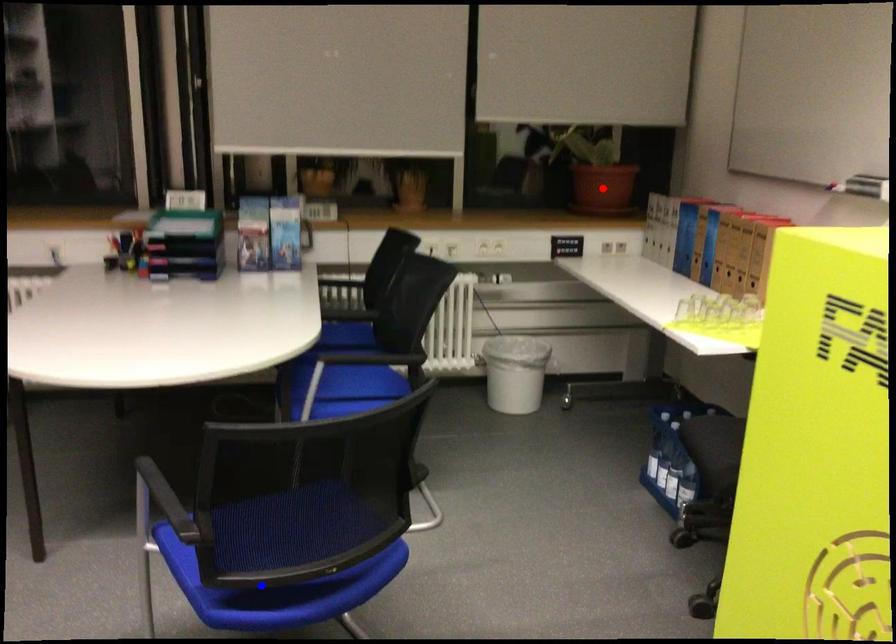
Question: Two points are marked on the image. Which point is closer to the camera?

Choices:
 (A) Blue point is closer.
 (B) Red point is closer.

Answer: (A)